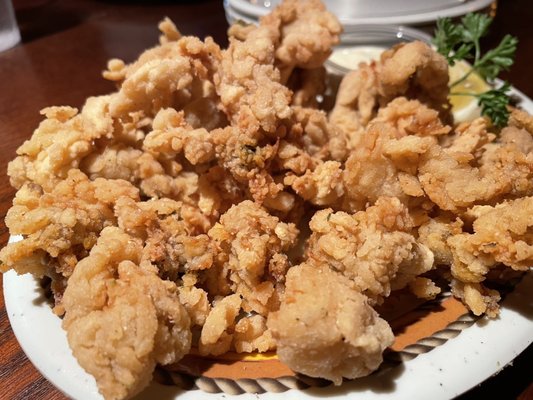
Where is `bowl`? This screenshot has height=400, width=533. bowl is located at coordinates (364, 31).